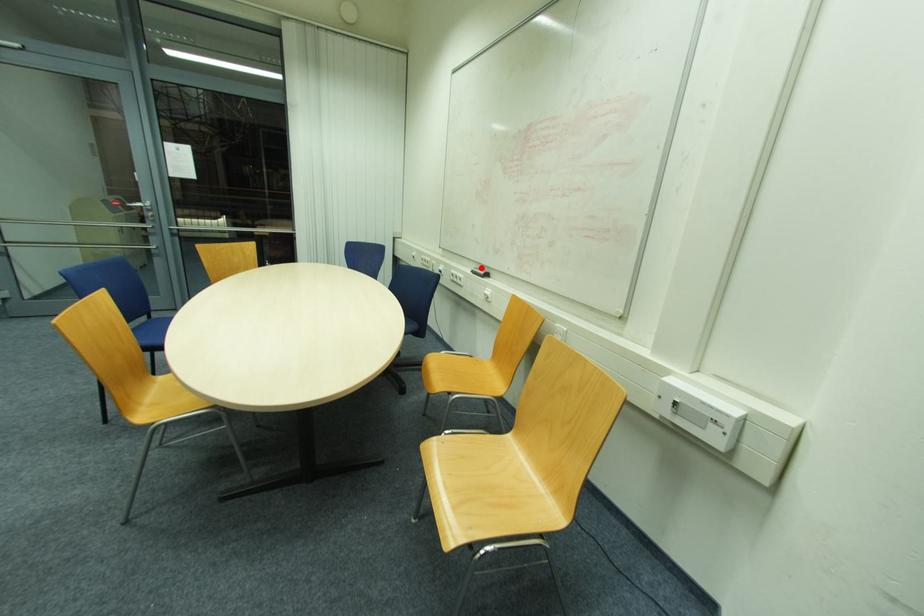
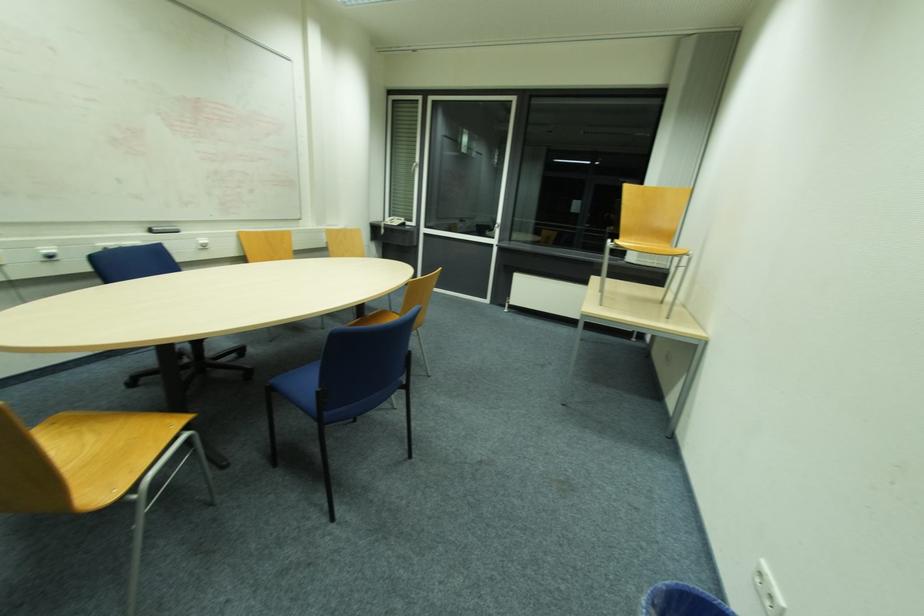
Locate, in the second image, the point that corresponds to the highlighted location in the first image.

(151, 227)